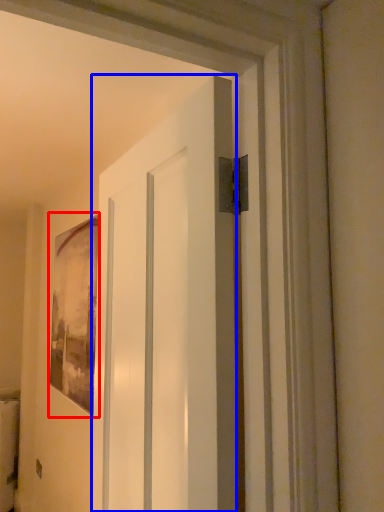
Question: Among these objects, which one is farthest to the camera, picture frame (highlighted by a red box) or door (highlighted by a blue box)?

Choices:
 (A) picture frame
 (B) door

Answer: (A)